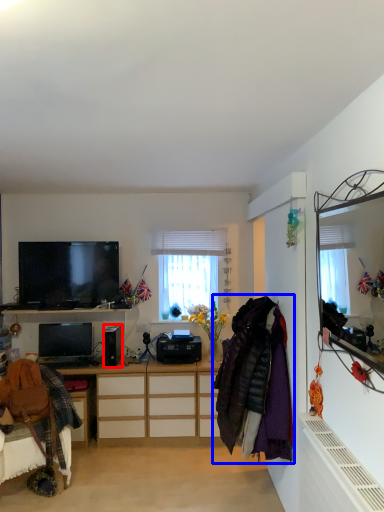
Question: Among these objects, which one is farthest to the camera, speaker (highlighted by a red box) or clothing (highlighted by a blue box)?

Choices:
 (A) speaker
 (B) clothing

Answer: (A)